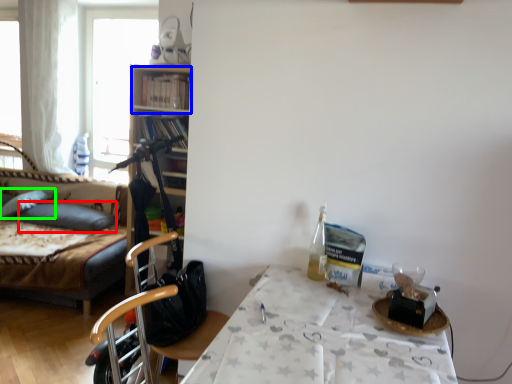
Question: Which object is positioned farthest from pillow (highlighted by a red box)? Select from shelf (highlighted by a blue box) and pillow (highlighted by a green box).

Choices:
 (A) shelf
 (B) pillow

Answer: (A)